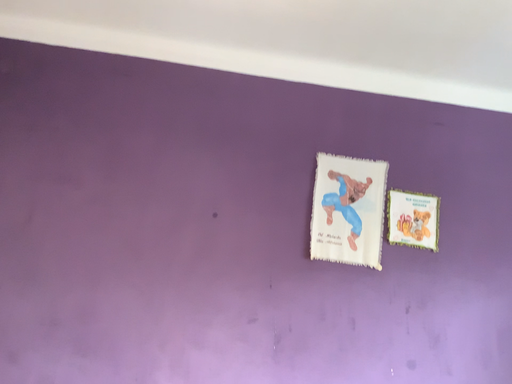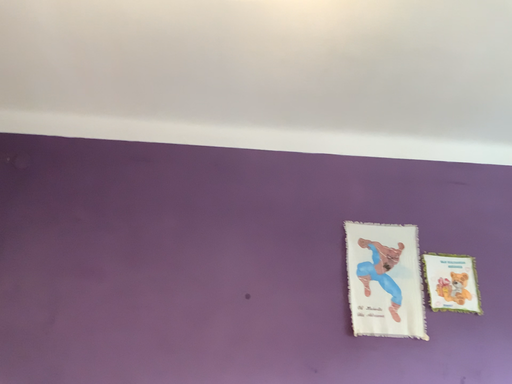
Question: Which way did the camera rotate in the video?

Choices:
 (A) rotated upward
 (B) rotated downward

Answer: (A)